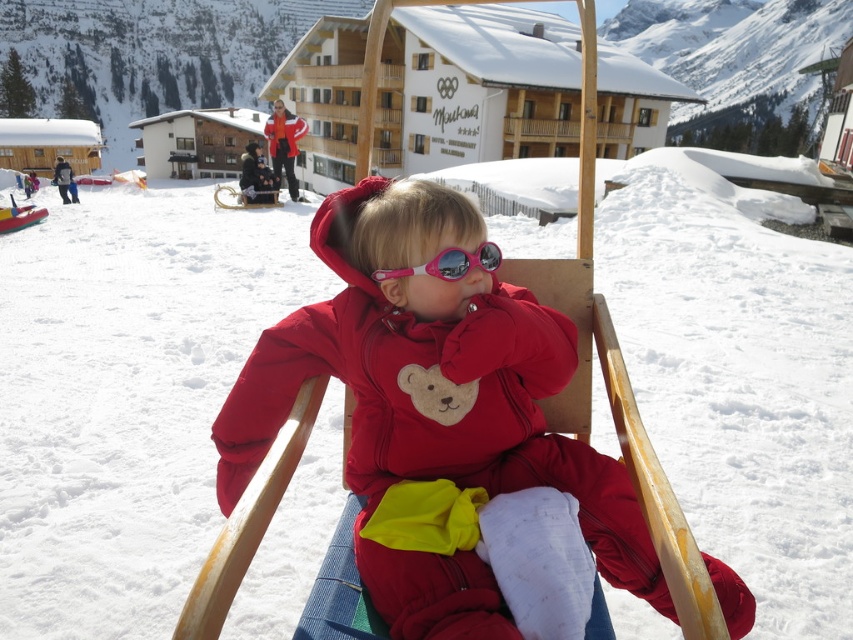
Is matte red snowsuit at center in front of pink plastic goggles at center?

Yes.

Does matte red snowsuit at center appear over pink plastic goggles at center?

No.

This screenshot has width=853, height=640. What are the coordinates of `matte red snowsuit at center` in the screenshot? It's located at (432, 404).

Measure the distance between point (483, 259) and camera.

The distance of point (483, 259) from camera is 1.71 meters.

Describe the element at coordinates (450, 262) in the screenshot. This screenshot has height=640, width=853. I see `pink plastic goggles at center` at that location.

Which is in front, point (457, 272) or point (291, 163)?

Point (457, 272) is more forward.

This screenshot has width=853, height=640. I want to click on pink plastic goggles at center, so click(x=450, y=262).

Can you confirm if matte red snowsuit at center is positioned to the left of matte red jacket at upper center?

In fact, matte red snowsuit at center is to the right of matte red jacket at upper center.

Can you confirm if matte red snowsuit at center is bigger than matte red jacket at upper center?

Actually, matte red snowsuit at center might be smaller than matte red jacket at upper center.

The image size is (853, 640). I want to click on matte red snowsuit at center, so click(x=432, y=404).